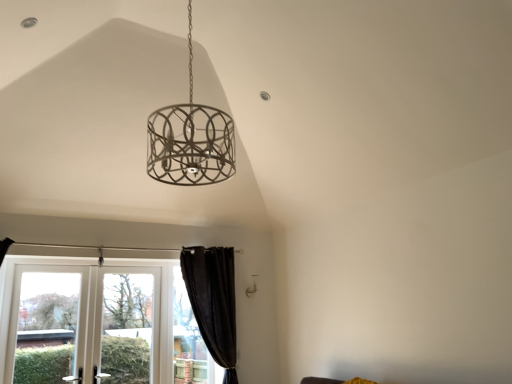
Question: From the image's perspective, would you say black curtain at lower left, acting as the 3th window starting from the left, is shown under clear glass screen door at lower left?

Choices:
 (A) yes
 (B) no

Answer: (A)

Question: Is black curtain at lower left, which is counted as the first window, starting from the right, behind clear glass screen door at lower left?

Choices:
 (A) no
 (B) yes

Answer: (B)

Question: Can you confirm if black curtain at lower left, acting as the 3th window starting from the left, is bigger than clear glass screen door at lower left?

Choices:
 (A) yes
 (B) no

Answer: (B)

Question: Is black curtain at lower left, acting as the 3th window starting from the left, facing towards clear glass screen door at lower left?

Choices:
 (A) yes
 (B) no

Answer: (B)

Question: Is clear glass screen door at lower left completely or partially inside black curtain at lower left, acting as the 3th window starting from the left?

Choices:
 (A) no
 (B) yes

Answer: (A)

Question: Is white plastic window at lower left, the second window when ordered from left to right, to the left or to the right of black curtain at lower left, which is counted as the first window, starting from the right, in the image?

Choices:
 (A) right
 (B) left

Answer: (B)

Question: From the image's perspective, is white plastic window at lower left, positioned as the second window in right-to-left order, positioned above or below black curtain at lower left, which is counted as the first window, starting from the right?

Choices:
 (A) below
 (B) above

Answer: (A)

Question: Relative to black curtain at lower left, acting as the 3th window starting from the left, is white plastic window at lower left, positioned as the second window in right-to-left order, in front or behind?

Choices:
 (A) behind
 (B) front

Answer: (B)

Question: From a real-world perspective, is white plastic window at lower left, positioned as the second window in right-to-left order, above or below black curtain at lower left, which is counted as the first window, starting from the right?

Choices:
 (A) above
 (B) below

Answer: (B)

Question: Do you think white glass door at lower left, the 3th window when ordered from right to left, is within white plastic window at lower left, the second window when ordered from left to right, or outside of it?

Choices:
 (A) inside
 (B) outside

Answer: (A)

Question: Considering the positions of white glass door at lower left, the 3th window when ordered from right to left, and white plastic window at lower left, the second window when ordered from left to right, in the image, is white glass door at lower left, the 3th window when ordered from right to left, bigger or smaller than white plastic window at lower left, the second window when ordered from left to right,?

Choices:
 (A) small
 (B) big

Answer: (A)

Question: In the image, is white glass door at lower left, the 3th window when ordered from right to left, positioned in front of or behind white plastic window at lower left, the second window when ordered from left to right?

Choices:
 (A) front
 (B) behind

Answer: (B)

Question: From the image's perspective, relative to white plastic window at lower left, positioned as the second window in right-to-left order, is white glass door at lower left, the 3th window when ordered from right to left, above or below?

Choices:
 (A) above
 (B) below

Answer: (A)

Question: Does point (41, 344) appear closer or farther from the camera than point (132, 284)?

Choices:
 (A) closer
 (B) farther

Answer: (A)

Question: Considering the positions of white plastic window at lower left, the second window when ordered from left to right, and clear glass screen door at lower left in the image, is white plastic window at lower left, the second window when ordered from left to right, wider or thinner than clear glass screen door at lower left?

Choices:
 (A) wide
 (B) thin

Answer: (B)